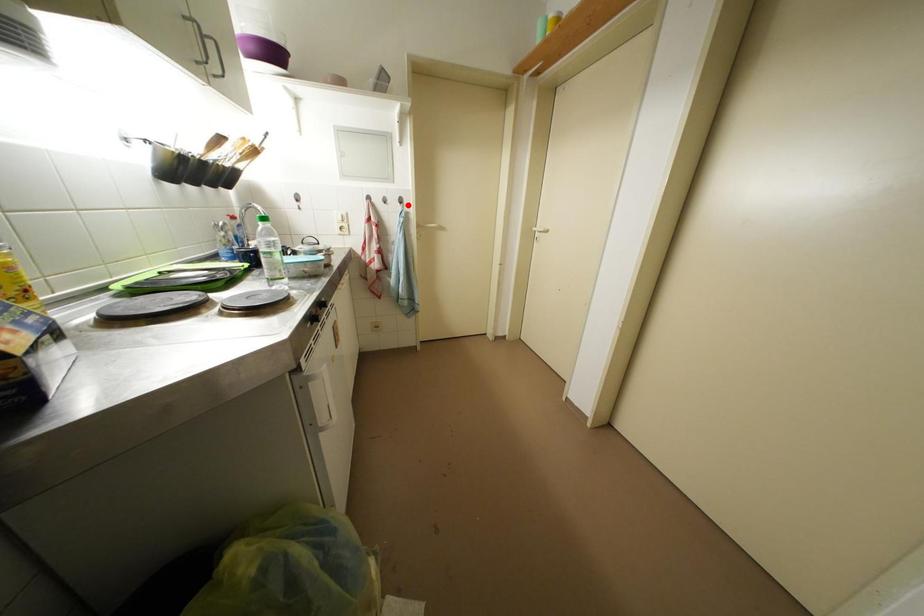
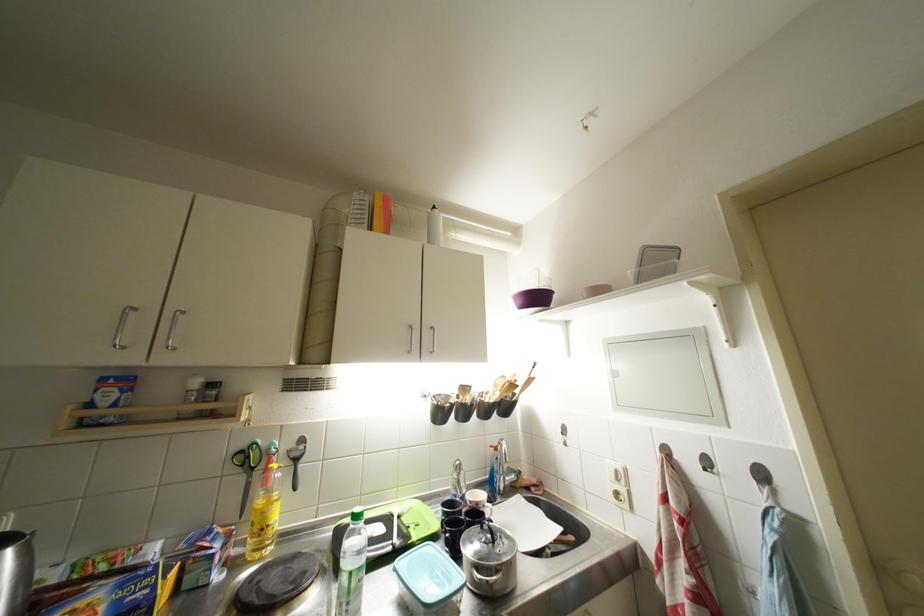
Find the pixel in the second image that matches the highlighted location in the first image.

(769, 479)